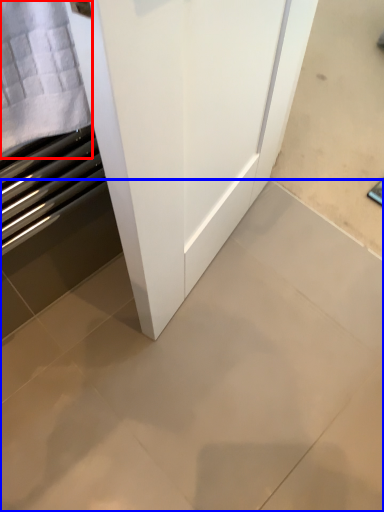
Question: Which point is further to the camera, cloth (highlighted by a red box) or ceramic tile (highlighted by a blue box)?

Choices:
 (A) cloth
 (B) ceramic tile

Answer: (B)